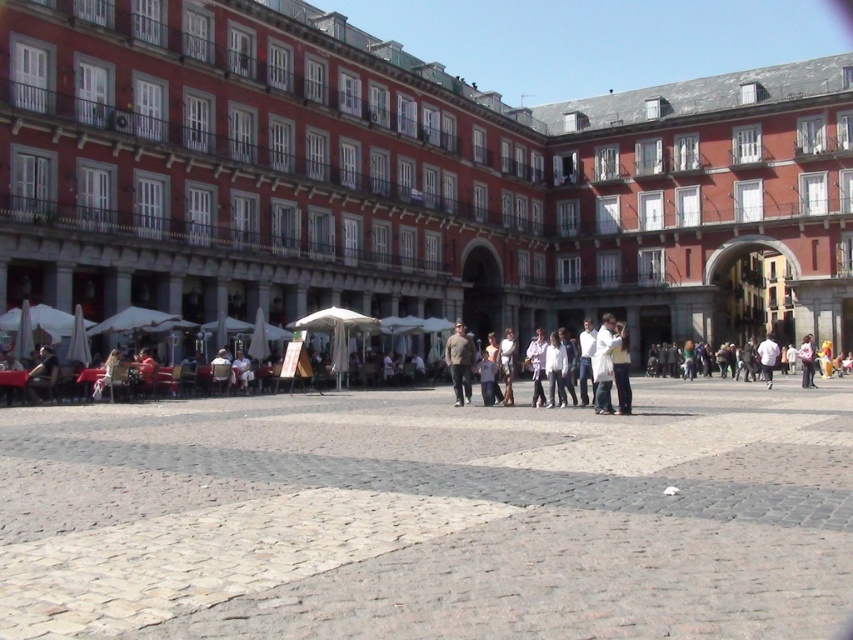
Does point (793, 173) come in front of point (454, 388)?

No, (793, 173) is further to viewer.

Who is shorter, red brick building at center or brown textured shirt at center?

Standing shorter between the two is brown textured shirt at center.

Between point (126, 161) and point (460, 355), which one is positioned behind?

The point (126, 161) is more distant.

What are the coordinates of `red brick building at center` in the screenshot? It's located at (398, 177).

Which is behind, point (73, 358) or point (457, 332)?

Positioned behind is point (457, 332).

Who is positioned more to the left, white cotton shirt at center or brown textured shirt at center?

Positioned to the left is brown textured shirt at center.

Between point (20, 312) and point (457, 326), which one is positioned behind?

The point (457, 326) is more distant.

I want to click on white cotton shirt at center, so [80, 324].

Find the location of a particular element. This screenshot has height=640, width=853. red brick building at center is located at coordinates (398, 177).

Who is positioned more to the right, red brick building at center or white cotton shirt at center?

red brick building at center

Image resolution: width=853 pixels, height=640 pixels. In order to click on red brick building at center in this screenshot , I will do `click(398, 177)`.